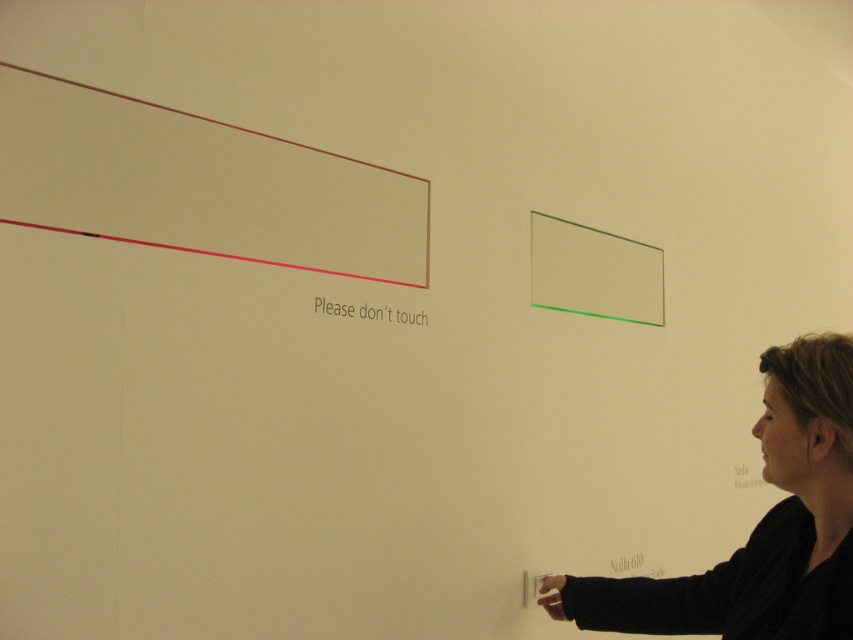
You are standing in front of the wall with the two frames. You notice the matte brown rectangle at upper left and the dark brown hair at lower right. Which object is located to the left of the other?

The matte brown rectangle at upper left is positioned on the left side of dark brown hair at lower right.

You are an art installer checking the dimensions of the frames. Which frame has a greater width between the matte brown rectangle at upper left and the green matte rectangle at upper right?

The matte brown rectangle at upper left has a greater width than the green matte rectangle at upper right.

You are standing in front of the wall with two frames. There is a point marked at coordinates (759, 525). What object is located at that point?

The dark brown hair at lower right is located at point (759, 525).